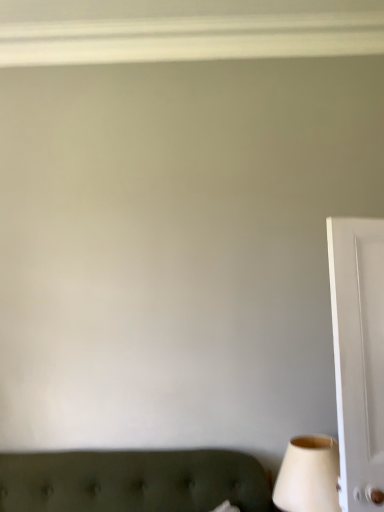
This screenshot has width=384, height=512. What do you see at coordinates (308, 475) in the screenshot? I see `beige fabric lampshade at lower right` at bounding box center [308, 475].

Locate an element on the screen. Image resolution: width=384 pixels, height=512 pixels. beige fabric lampshade at lower right is located at coordinates (308, 475).

The image size is (384, 512). Identify the location of beige fabric lampshade at lower right. (308, 475).